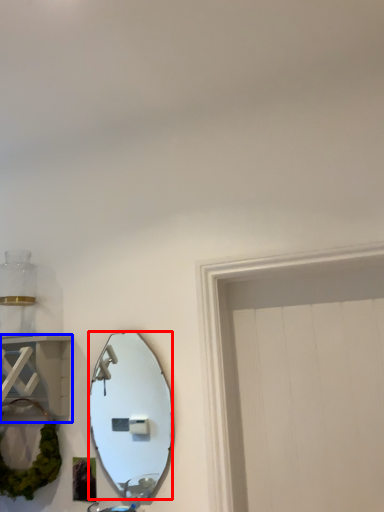
Question: Which object appears closest to the camera in this image, mirror (highlighted by a red box) or cabinet (highlighted by a blue box)?

Choices:
 (A) mirror
 (B) cabinet

Answer: (B)